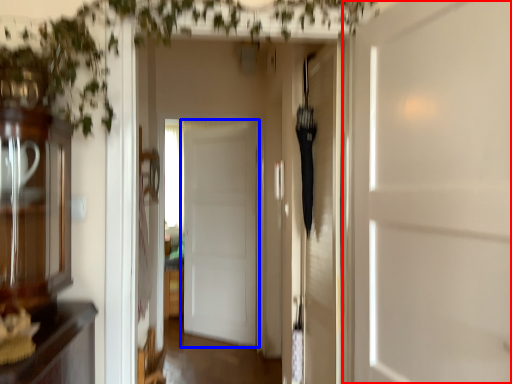
Question: Which object appears closest to the camera in this image, door (highlighted by a red box) or door (highlighted by a blue box)?

Choices:
 (A) door
 (B) door

Answer: (A)